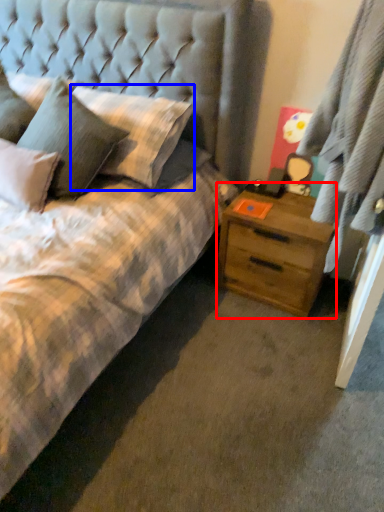
Question: Which of the following is the closest to the observer, nightstand (highlighted by a red box) or pillow (highlighted by a blue box)?

Choices:
 (A) nightstand
 (B) pillow

Answer: (B)